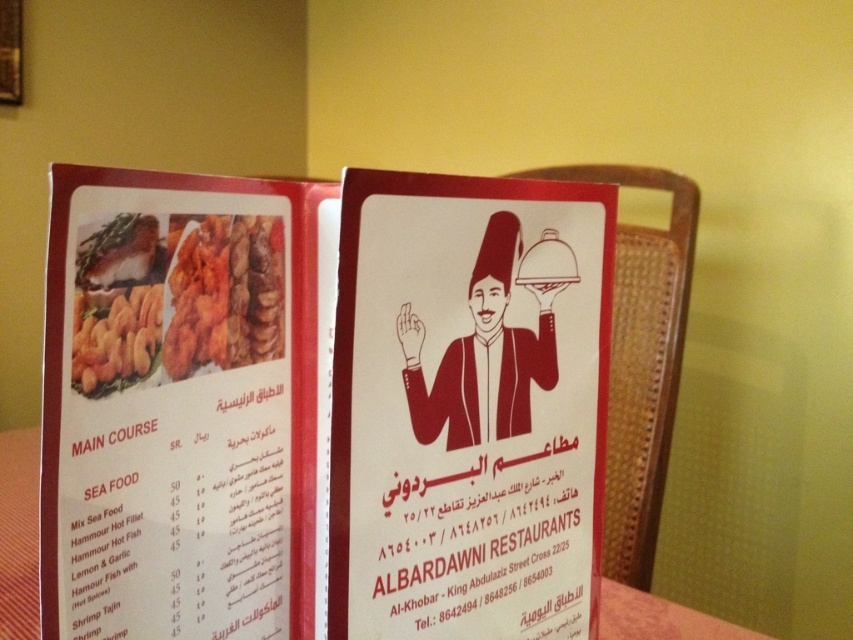
You are looking at the menu from Albardawi Restaurants in Al Khobar. You notice two points marked on the menu. The first point is at coordinates point (x=120, y=484) and the second is at point (x=265, y=260). Which point is closer to you?

Point (x=120, y=484) is closer to the camera than point (x=265, y=260).

You are holding a smartphone that is 15 centimeters long. You want to take a photo of the matte paper menu at center. Can your phone fit entirely within the menu when held horizontally? Please explain.

The matte paper menu at center is 28.05 centimeters from the viewer. Since the phone is 15 centimeters long, it can fit within the menu as the menu is wider than the phone.